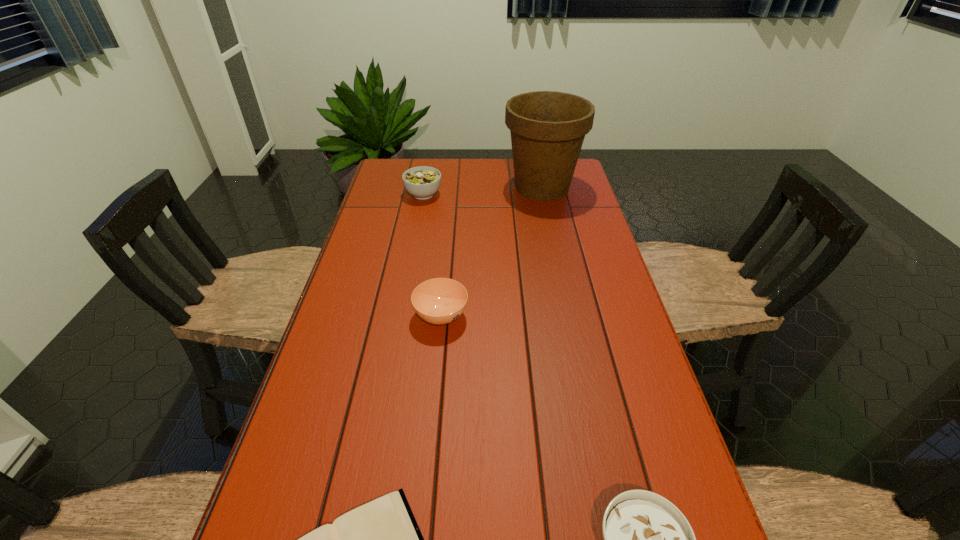
Find the location of a particular element. The height and width of the screenshot is (540, 960). the tallest object is located at coordinates 547,128.

Image resolution: width=960 pixels, height=540 pixels. Find the location of `the farthest soup bowl`. the farthest soup bowl is located at coordinates (422, 182).

Find the location of a particular element. The height and width of the screenshot is (540, 960). the second nearest soup bowl is located at coordinates (439, 301).

Identify the location of vacant space located on the left of the flowerpot. [x=478, y=187].

At what (x,y) coordinates should I click in order to perform the action: click on vacant space situated 0.150m on the front of the farthest soup bowl. Please return your answer as a coordinate pair (x, y). Image resolution: width=960 pixels, height=540 pixels. Looking at the image, I should click on (417, 229).

You are a GUI agent. You are given a task and a screenshot of the screen. Output one action in this format:
    pyautogui.click(x=<x>, y=<y>)
    Task: Click on the free space located 0.060m on the back of the second farthest soup bowl
    The height and width of the screenshot is (540, 960).
    Given the screenshot: What is the action you would take?
    pyautogui.click(x=444, y=282)

Locate an element on the screen. The width and height of the screenshot is (960, 540). flowerpot located in the far edge section of the desktop is located at coordinates (547, 128).

Locate an element on the screen. Image resolution: width=960 pixels, height=540 pixels. soup bowl situated at the far edge is located at coordinates (422, 182).

You are a GUI agent. You are given a task and a screenshot of the screen. Output one action in this format:
    pyautogui.click(x=<x>, y=<y>)
    Task: Click on the object at the left edge
    The width and height of the screenshot is (960, 540).
    Given the screenshot: What is the action you would take?
    422,182

Where is `object present at the right edge`? This screenshot has width=960, height=540. object present at the right edge is located at coordinates (547, 128).